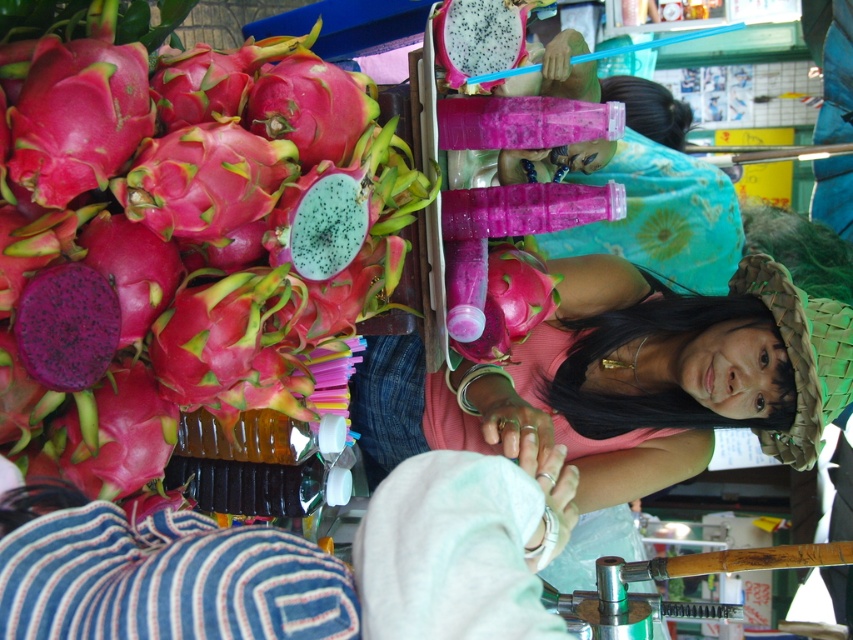
Question: Which point is closer to the camera?

Choices:
 (A) pink matte dragon fruit at left
 (B) pink matte dragonfruit at upper left

Answer: (A)

Question: Which point appears closest to the camera in this image?

Choices:
 (A) (421, 436)
 (B) (376, 536)
 (C) (74, 381)

Answer: (B)

Question: Which point is farther to the camera?

Choices:
 (A) (346, 88)
 (B) (558, 426)

Answer: (B)

Question: Is the position of pink matte dragon fruit at left less distant than that of pink matte dragon fruit at center?

Choices:
 (A) yes
 (B) no

Answer: (A)

Question: Can you confirm if pink matte dragon fruit at left is bigger than pink matte dragon fruit at center?

Choices:
 (A) no
 (B) yes

Answer: (A)

Question: Does pink matte dragonfruit at upper left have a greater width compared to pink matte dragon fruit at left?

Choices:
 (A) no
 (B) yes

Answer: (B)